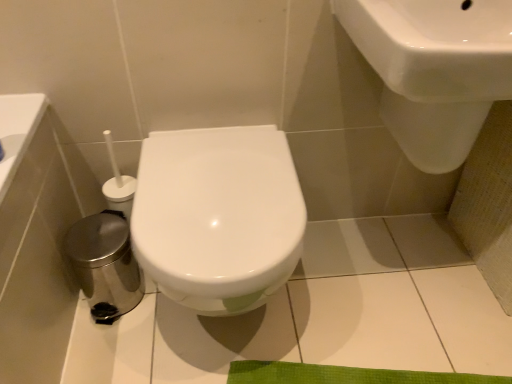
Where is `empty space that is to the right of white glossy toilet at center`? This screenshot has height=384, width=512. empty space that is to the right of white glossy toilet at center is located at coordinates (367, 299).